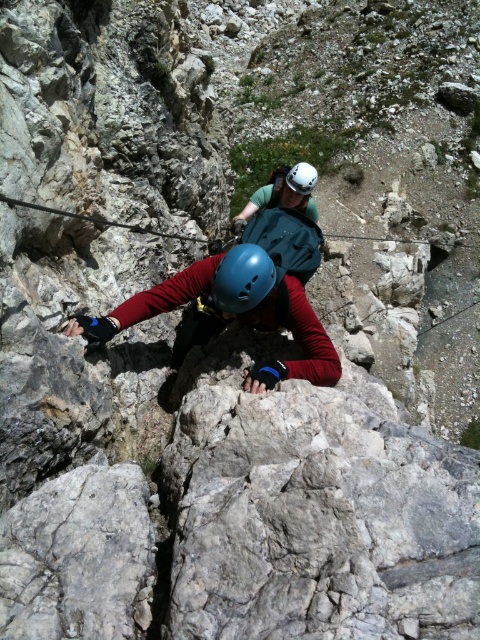
Which of these two, blue matte helmet at center or white matte helmet at center, stands taller?

With more height is white matte helmet at center.

At what (x,y) coordinates should I click in order to perform the action: click on blue matte helmet at center. Please return your answer as a coordinate pair (x, y). Looking at the image, I should click on (241, 280).